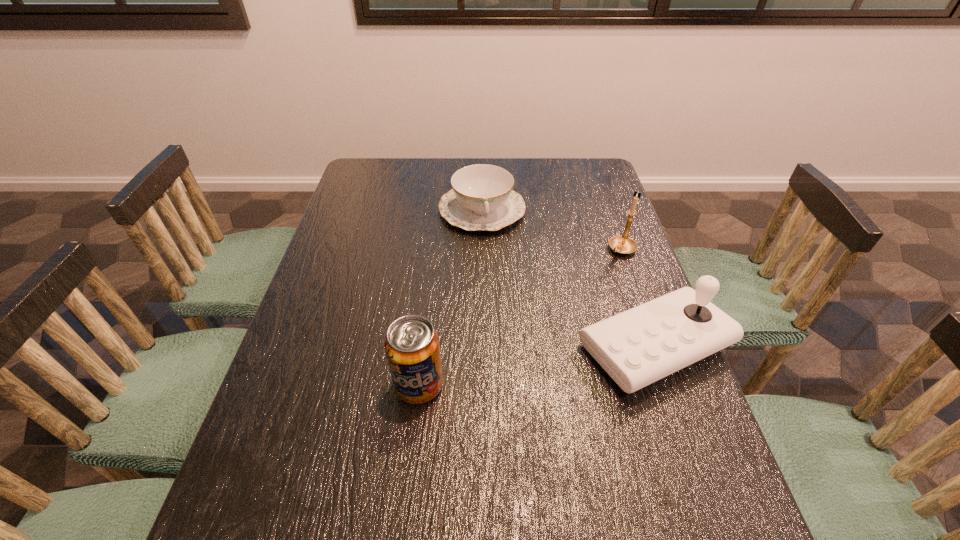
Where is `vacant area located on the handle side of the farthest object`? This screenshot has height=540, width=960. vacant area located on the handle side of the farthest object is located at coordinates tap(493, 275).

I want to click on free region located on the handle side of the farthest object, so click(x=493, y=278).

The width and height of the screenshot is (960, 540). I want to click on free space located on the handle side of the farthest object, so click(489, 252).

Identify the location of object located at the far edge. This screenshot has width=960, height=540. (482, 198).

In order to click on joystick situated at the right edge in this screenshot , I will do `click(637, 347)`.

Identify the location of candle holder present at the right edge. Image resolution: width=960 pixels, height=540 pixels. (622, 244).

In the image, there is a desktop. Where is `vacant space at the far edge`? The image size is (960, 540). vacant space at the far edge is located at coordinates (455, 161).

This screenshot has height=540, width=960. Find the location of `vacant space at the near edge of the desktop`. vacant space at the near edge of the desktop is located at coordinates (582, 458).

In the image, there is a desktop. Identify the location of free space at the left edge. (377, 210).

Locate an element on the screen. free region at the right edge of the desktop is located at coordinates (664, 436).